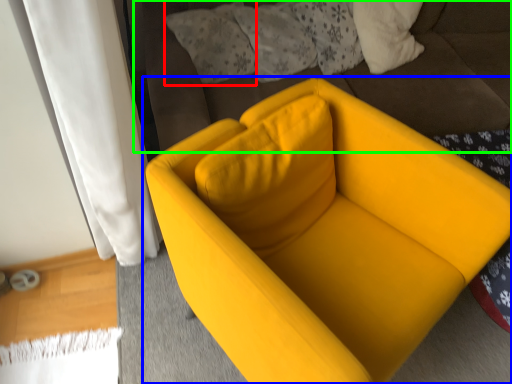
Question: Considering the real-world distances, which object is farthest from pillow (highlighted by a red box)? chair (highlighted by a blue box) or bedding (highlighted by a green box)?

Choices:
 (A) chair
 (B) bedding

Answer: (A)